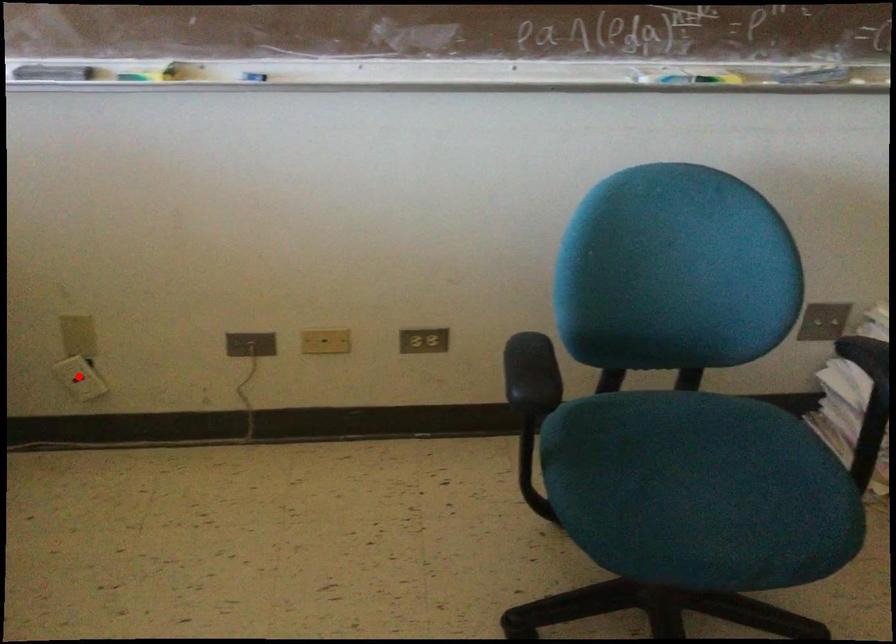
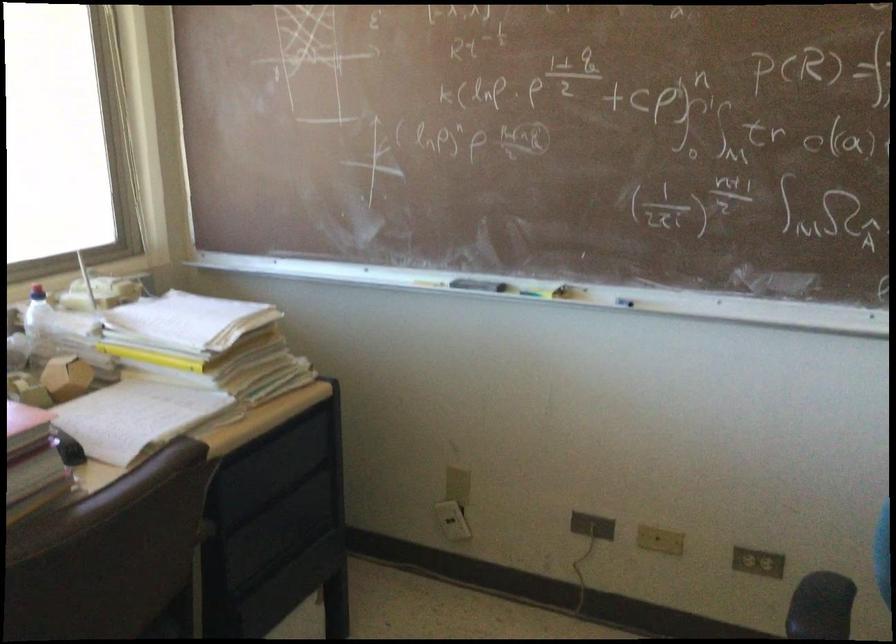
In the second image, find the point that corresponds to the highlighted location in the first image.

(452, 520)